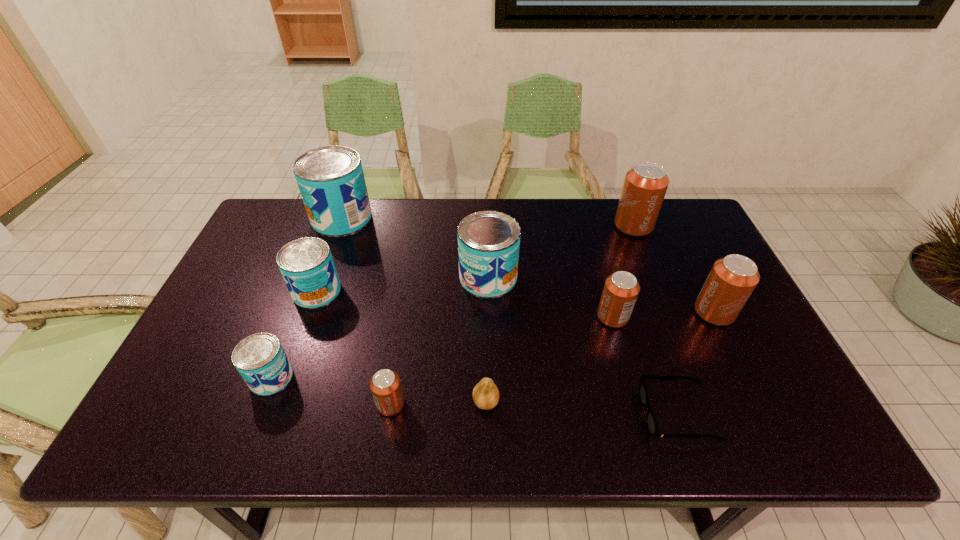
Where is `the farthest blue can`? The image size is (960, 540). the farthest blue can is located at coordinates coord(331,181).

I want to click on the farthest orange can, so click(645, 185).

This screenshot has width=960, height=540. What are the coordinates of `the second orange can from right to left` in the screenshot? It's located at point(645,185).

Locate an element on the screen. the second biggest blue can is located at coordinates (488, 241).

Locate an element on the screen. The image size is (960, 540). the fourth can from right to left is located at coordinates (488, 241).

At what (x,y) coordinates should I click in order to perform the action: click on the rightmost can. Please return your answer as a coordinate pair (x, y). The image size is (960, 540). Looking at the image, I should click on (732, 279).

Locate an element on the screen. the rightmost orange can is located at coordinates (732, 279).

Where is `the third biggest blue can`? the third biggest blue can is located at coordinates (x=306, y=264).

At what (x,y) coordinates should I click in order to perform the action: click on the second smallest orange can. Please return your answer as a coordinate pair (x, y). Looking at the image, I should click on (621, 289).

In order to click on the second orange can from left to right in this screenshot , I will do `click(621, 289)`.